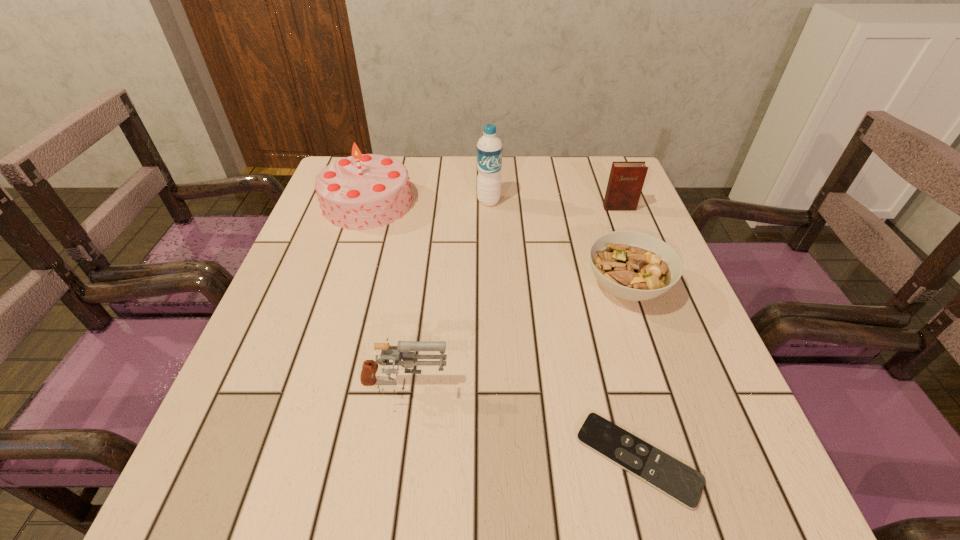
Locate an element on the screen. vacant space positioned 0.220m on the label of the tallest object is located at coordinates (491, 265).

The height and width of the screenshot is (540, 960). Identify the location of vacant space located on the front of the birthday cake. (343, 282).

Locate an element on the screen. This screenshot has width=960, height=540. free space located 0.080m on the front cover of the diary is located at coordinates (628, 230).

Where is `free spot located 0.160m at the barrel end of the third shortest object`? free spot located 0.160m at the barrel end of the third shortest object is located at coordinates (539, 388).

I want to click on blank space located 0.310m on the front of the second shortest object, so click(x=690, y=476).

This screenshot has height=540, width=960. I want to click on vacant area situated 0.080m on the right of the shortest object, so (748, 459).

Where is `water bottle at the far edge`? This screenshot has height=540, width=960. water bottle at the far edge is located at coordinates pyautogui.click(x=489, y=147).

You are a GUI agent. You are given a task and a screenshot of the screen. Output one action in this format:
    pyautogui.click(x=<x>, y=<y>)
    Task: Click on the birthday cake at the far edge
    
    Given the screenshot: What is the action you would take?
    pyautogui.click(x=364, y=191)

Locate an element on the screen. The image size is (960, 540). object present at the near edge is located at coordinates (685, 485).

Locate an element on the screen. object at the left edge is located at coordinates (364, 191).